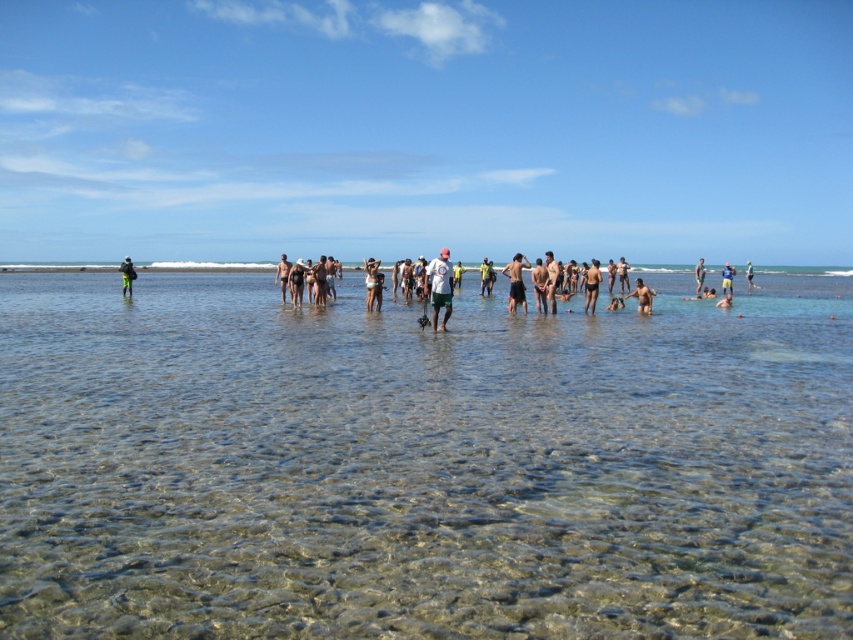
Can you confirm if white matte shirt at center is shorter than matte black wetsuit at left?

No.

Does white matte shirt at center appear over matte black wetsuit at left?

Actually, white matte shirt at center is below matte black wetsuit at left.

Describe the element at coordinates (439, 285) in the screenshot. This screenshot has height=640, width=853. I see `white matte shirt at center` at that location.

Find the location of `white matte shirt at center`. white matte shirt at center is located at coordinates (439, 285).

Does white matte shirt at center have a greater height compared to blue fabric shirt at center?

No, white matte shirt at center is not taller than blue fabric shirt at center.

Consider the image. Can you confirm if white matte shirt at center is positioned to the left of blue fabric shirt at center?

Correct, you'll find white matte shirt at center to the left of blue fabric shirt at center.

Which is behind, point (432, 312) or point (732, 275)?

The point (732, 275) is behind.

Where is `white matte shirt at center`? This screenshot has width=853, height=640. white matte shirt at center is located at coordinates (439, 285).

Between white cotton shirt at center and matte black swimsuit at center, which one appears on the left side from the viewer's perspective?

white cotton shirt at center

Based on the photo, which of these two, white cotton shirt at center or matte black swimsuit at center, stands shorter?

Standing shorter between the two is matte black swimsuit at center.

Locate an element on the screen. This screenshot has height=640, width=853. white cotton shirt at center is located at coordinates (311, 280).

Where is `white cotton shirt at center`? This screenshot has width=853, height=640. white cotton shirt at center is located at coordinates (311, 280).